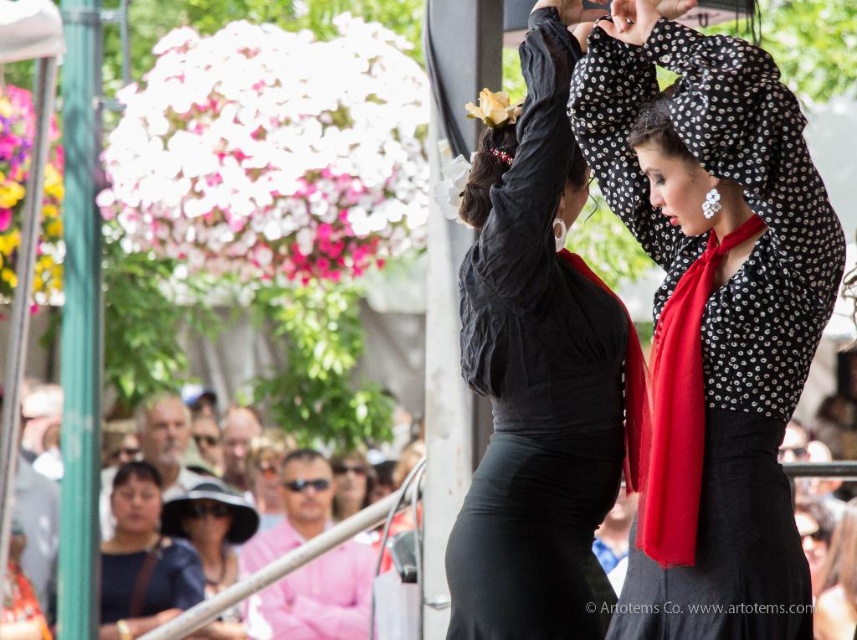
You are a photographer at the flamenco performance. You want to capture a closeup shot of the dancer wearing the black satin dress at center without including the black satin skirt at center in the frame. Is this possible given their spatial relationship?

The black satin dress at center occupies less space than the black satin skirt at center, so it might be challenging to capture a closeup of the black satin dress at center without including the black satin skirt at center in the frame due to their proximity in size and position.

You are a photographer at the flamenco performance. You want to capture a shot where the polka dot blouse at center and the black satin dress at center are both visible. Since you can only focus on one object, which one should you focus on to ensure the other is still in the frame?

The polka dot blouse at center is below the black satin dress at center, so focusing on the black satin dress at center will keep the polka dot blouse at center in the frame below it.

You are a photographer standing at the edge of the stage where the flamenco dancers are performing. You want to take a photo that includes both the polka dot blouse at center and the black satin dress at center. If your camera has a maximum focus range of 4 feet, will you be able to capture both subjects in sharp focus?

The polka dot blouse at center is 4.58 feet away from the black satin dress at center. Since the distance between them exceeds the camera s maximum focus range of 4 feet, capturing both in sharp focus may be challenging. Adjust your position or use a different lens to ensure both subjects are within the focus range.